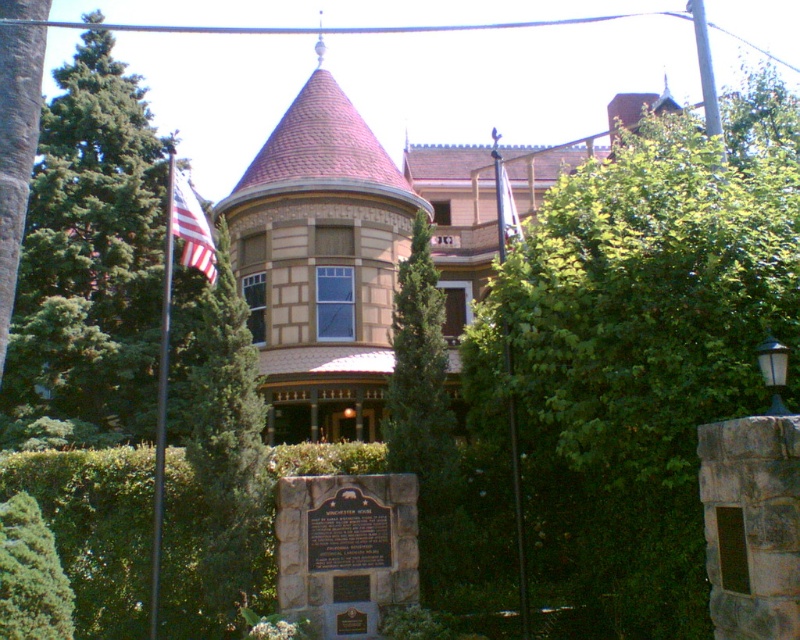
You are a landscape architect designing a garden path that needs to pass between the green textured tree at left and the white fabric flag at upper center. Considering their heights, which object might require trimming or adjustment to ensure the path remains unobstructed for pedestrians?

The green textured tree at left is shorter than the white fabric flag at upper center. Since the tree is shorter, it might not obstruct the path as much as the flag. However, the flag at upper center is taller, so it might need adjustment to ensure there is enough vertical clearance for pedestrians.

You are standing in front of the historic building and want to take a photo that includes both the green textured tree at left and the white fabric flag at upper center. Which object should you position closer to the bottom of your camera frame?

You should position the green textured tree at left closer to the bottom of your camera frame since it is located below the white fabric flag at upper center.

You are a photographer wanting to capture both the brown textured mansion at center and the white fabric flag at upper center in the same frame. Based on their positions, which object should you adjust your camera to focus on first to ensure both are visible?

The brown textured mansion at center is to the left of white fabric flag at upper center, so you should focus on the white fabric flag at upper center first to ensure both are visible in the frame.